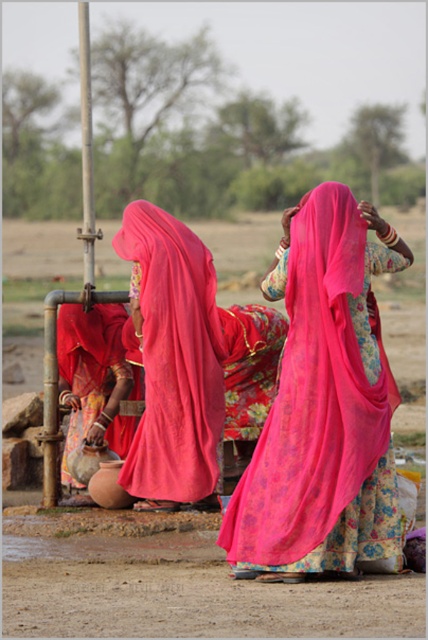
You are a photographer trying to capture the silky pink sari at center and the matte clay pot at lower left in the same frame. Based on their positions, which object should you adjust your camera to focus on first to ensure both are in the shot?

The silky pink sari at center is to the right of matte clay pot at lower left, so you should focus on the matte clay pot at lower left first to ensure both are in the frame as the sari is positioned further right.